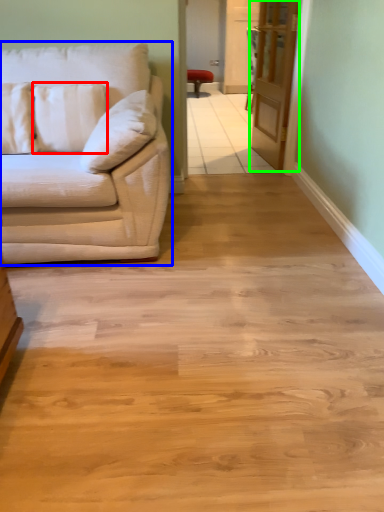
Question: Which object is the farthest from pillow (highlighted by a red box)? Choose among these: studio couch (highlighted by a blue box) or glass door (highlighted by a green box).

Choices:
 (A) studio couch
 (B) glass door

Answer: (B)